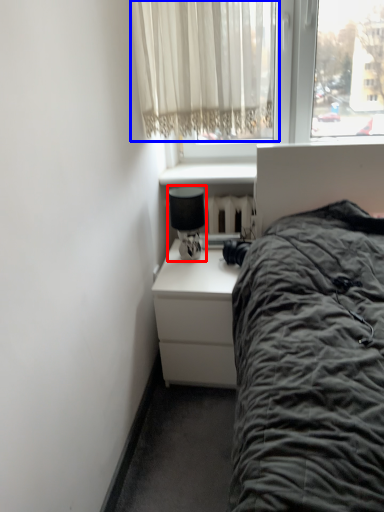
Question: Which object is closer to the camera taking this photo, lamp (highlighted by a red box) or curtain (highlighted by a blue box)?

Choices:
 (A) lamp
 (B) curtain

Answer: (B)